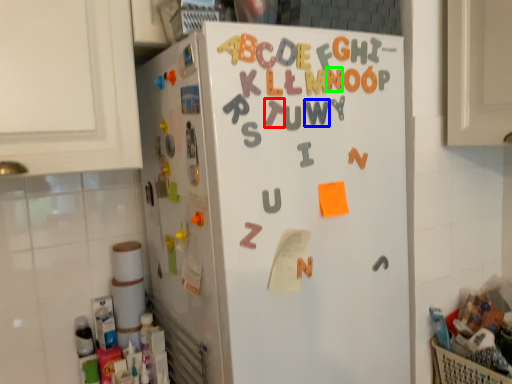
Question: Which object is the farthest from letter (highlighted by a red box)? Choose among these: letter (highlighted by a blue box) or letter (highlighted by a green box).

Choices:
 (A) letter
 (B) letter

Answer: (B)